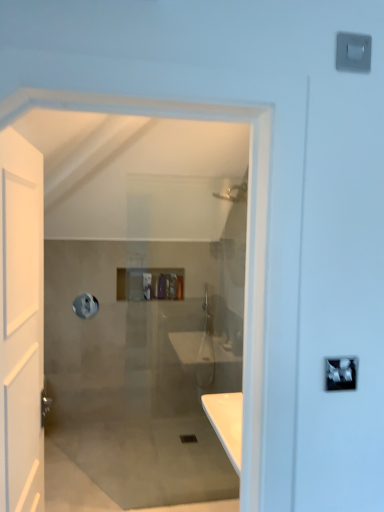
Question: Is white matte door at left in front of or behind translucent plastic toiletries at center in the image?

Choices:
 (A) behind
 (B) front

Answer: (B)

Question: In the image, is white matte door at left on the left side or the right side of translucent plastic toiletries at center?

Choices:
 (A) left
 (B) right

Answer: (A)

Question: Which object is positioned closest to the silver metallic lock at upper right?

Choices:
 (A) translucent plastic toiletries at center
 (B) white matte door at left
 (C) silver metallic towel bar at upper left
 (D) white plastic light switch at upper right

Answer: (B)

Question: Based on their relative distances, which object is farther from the translucent plastic toiletries at center?

Choices:
 (A) white matte door at left
 (B) silver metallic towel bar at upper left
 (C) silver metallic lock at upper right
 (D) white plastic light switch at upper right

Answer: (C)